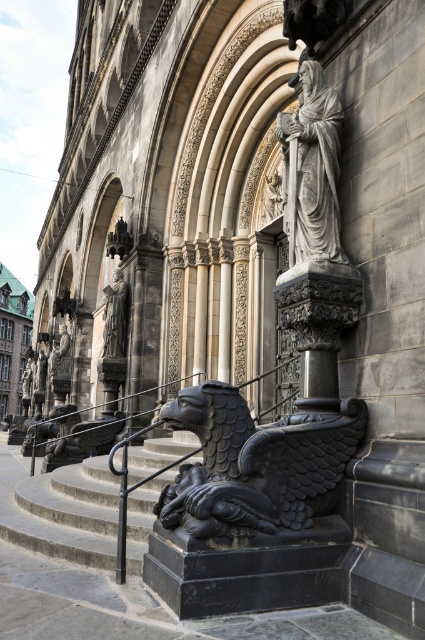
Question: Does black stone gargoyle at center have a smaller size compared to matte gray statue at center?

Choices:
 (A) no
 (B) yes

Answer: (B)

Question: Estimate the real-world distances between objects in this image. Which object is closer to the black stone gargoyle at center?

Choices:
 (A) gray stone statue at upper right
 (B) matte gray statue at center

Answer: (A)

Question: Does black stone stairs at lower left appear on the left side of matte gray statue at center?

Choices:
 (A) no
 (B) yes

Answer: (A)

Question: Among these objects, which one is nearest to the camera?

Choices:
 (A) gray stone statue at upper right
 (B) black stone gargoyle at center

Answer: (B)

Question: Which of the following is the closest to the observer?

Choices:
 (A) gray stone statue at upper right
 (B) black stone gargoyle at center
 (C) matte gray statue at center

Answer: (B)

Question: Is black stone gargoyle at center positioned behind matte gray statue at center?

Choices:
 (A) yes
 (B) no

Answer: (B)